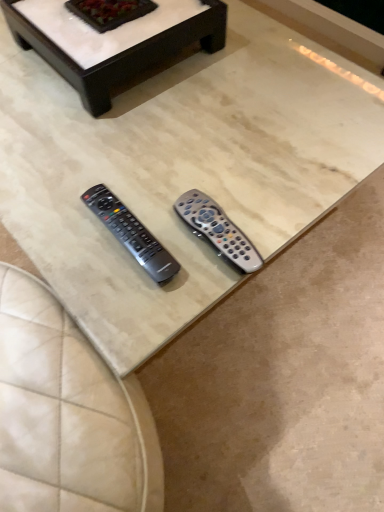
Find the location of a particular element. The width and height of the screenshot is (384, 512). free space to the left of silver metallic remote at center, which ranks as the second remote control in right-to-left order is located at coordinates (58, 228).